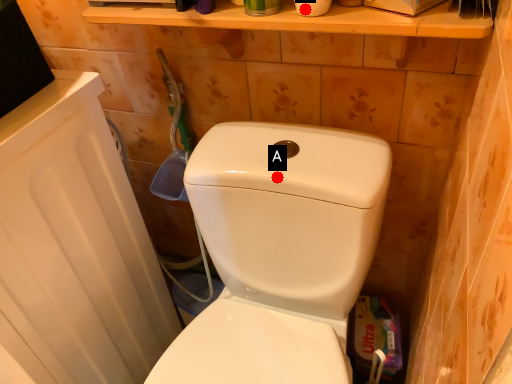
Question: Two points are circled on the image, labeled by A and B beside each circle. Which point appears farthest from the camera in this image?

Choices:
 (A) A is further
 (B) B is further

Answer: (A)